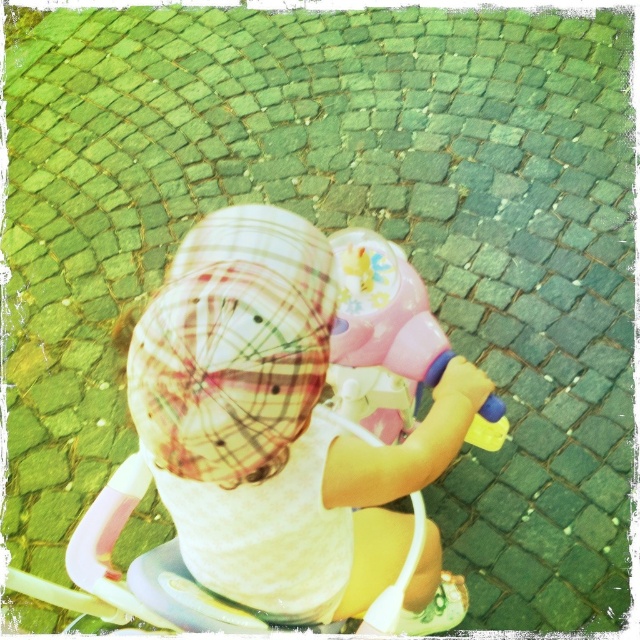
Question: Is white plaid hat at center below pink plastic toy at center?

Choices:
 (A) no
 (B) yes

Answer: (B)

Question: Which point appears closest to the camera in this image?

Choices:
 (A) (211, 317)
 (B) (364, 358)

Answer: (A)

Question: Can you confirm if white plaid hat at center is wider than pink plastic toy at center?

Choices:
 (A) no
 (B) yes

Answer: (B)

Question: Is white plaid hat at center thinner than pink plastic toy at center?

Choices:
 (A) yes
 (B) no

Answer: (B)